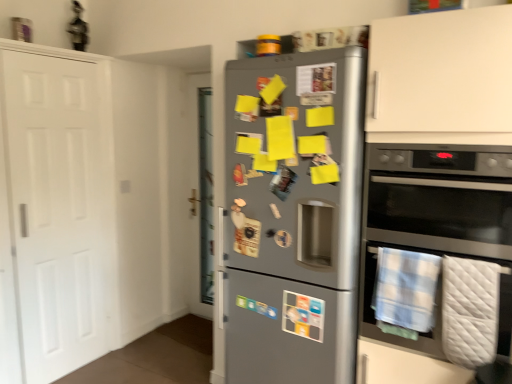
What do you see at coordinates (444, 243) in the screenshot? I see `stainless steel oven at right` at bounding box center [444, 243].

Locate an element on the screen. The width and height of the screenshot is (512, 384). white matte door at left is located at coordinates (58, 209).

Consider the image. Measure the distance between point [379,291] and camera.

Point [379,291] and camera are 6.04 feet apart.

The width and height of the screenshot is (512, 384). I want to click on white quilted blanket at lower right, which is the second blanket from left to right, so click(470, 311).

Locate an element on the screen. The image size is (512, 384). satin silver fridge at center is located at coordinates (293, 216).

From the image's perspective, relative to blue plaid towel at lower right, which is counted as the second blanket, starting from the right, is white matte door at left above or below?

Based on their image positions, white matte door at left is located above blue plaid towel at lower right, which is counted as the second blanket, starting from the right.

Do you think white matte door at left is within blue plaid towel at lower right, which is counted as the second blanket, starting from the right, or outside of it?

white matte door at left lies outside blue plaid towel at lower right, which is counted as the second blanket, starting from the right.

This screenshot has height=384, width=512. Identify the location of door behind the blue plaid towel at lower right, which is counted as the first blanket, starting from the left. (58, 209).

Would you say blue plaid towel at lower right, which is counted as the first blanket, starting from the left, is a long distance from white quilted blanket at lower right, which is the second blanket from left to right?

They are positioned close to each other.

From a real-world perspective, relative to white quilted blanket at lower right, which ranks as the first blanket in right-to-left order, is blue plaid towel at lower right, which is counted as the first blanket, starting from the left, vertically above or below?

blue plaid towel at lower right, which is counted as the first blanket, starting from the left, is situated higher than white quilted blanket at lower right, which ranks as the first blanket in right-to-left order, in the real world.

Considering the sizes of objects blue plaid towel at lower right, which is counted as the second blanket, starting from the right, and white quilted blanket at lower right, which ranks as the first blanket in right-to-left order, in the image provided, who is shorter, blue plaid towel at lower right, which is counted as the second blanket, starting from the right, or white quilted blanket at lower right, which ranks as the first blanket in right-to-left order,?

Standing shorter between the two is blue plaid towel at lower right, which is counted as the second blanket, starting from the right.

Image resolution: width=512 pixels, height=384 pixels. In order to click on blanket above the white quilted blanket at lower right, which is the second blanket from left to right (from the image's perspective) in this screenshot , I will do click(x=405, y=291).

From a real-world perspective, which object stands above the other?

From a 3D spatial view, stainless steel oven at right is above.

From the image's perspective, is satin silver fridge at center beneath stainless steel oven at right?

Correct, satin silver fridge at center appears lower than stainless steel oven at right in the image.

How different are the orientations of satin silver fridge at center and stainless steel oven at right in degrees?

They differ by 0.501 degrees in their facing directions.

Who is smaller, satin silver fridge at center or stainless steel oven at right?

stainless steel oven at right is smaller.

Is satin silver fridge at center taller than blue plaid towel at lower right, which is counted as the second blanket, starting from the right?

Yes.

In the scene shown: Is satin silver fridge at center positioned with its back to blue plaid towel at lower right, which is counted as the second blanket, starting from the right?

No, satin silver fridge at center is not facing the opposite direction of blue plaid towel at lower right, which is counted as the second blanket, starting from the right.

From a real-world perspective, who is located lower, satin silver fridge at center or blue plaid towel at lower right, which is counted as the first blanket, starting from the left?

In real-world perspective, blue plaid towel at lower right, which is counted as the first blanket, starting from the left, is lower.

From the image's perspective, is satin silver fridge at center on blue plaid towel at lower right, which is counted as the second blanket, starting from the right?

Yes.

From the image's perspective, is white matte door at left below satin silver fridge at center?

No, from the image's perspective, white matte door at left is not below satin silver fridge at center.

Is point (106, 207) more distant than point (327, 67)?

Yes, it is.

What's the angular difference between white matte door at left and satin silver fridge at center's facing directions?

92.1 degrees.

From the picture: In terms of height, does white matte door at left look taller or shorter compared to satin silver fridge at center?

Considering their sizes, white matte door at left has more height than satin silver fridge at center.

Is point (472, 261) closer or farther from the camera than point (429, 296)?

Clearly, point (472, 261) is closer to the camera than point (429, 296).

From the image's perspective, is white quilted blanket at lower right, which is the second blanket from left to right, located above or below stainless steel oven at right?

white quilted blanket at lower right, which is the second blanket from left to right, is below stainless steel oven at right.

In the image, is white quilted blanket at lower right, which ranks as the first blanket in right-to-left order, positioned in front of or behind stainless steel oven at right?

Clearly, white quilted blanket at lower right, which ranks as the first blanket in right-to-left order, is behind stainless steel oven at right.

Is white quilted blanket at lower right, which ranks as the first blanket in right-to-left order, with stainless steel oven at right?

white quilted blanket at lower right, which ranks as the first blanket in right-to-left order, and stainless steel oven at right are clearly separated.

From the image's perspective, is satin silver fridge at center on top of white quilted blanket at lower right, which ranks as the first blanket in right-to-left order?

Yes, from the image's perspective, satin silver fridge at center is above white quilted blanket at lower right, which ranks as the first blanket in right-to-left order.

Is satin silver fridge at center inside or outside of white quilted blanket at lower right, which is the second blanket from left to right?

The correct answer is: outside.

Can you tell me how much satin silver fridge at center and white quilted blanket at lower right, which is the second blanket from left to right, differ in facing direction?

1.23 degrees.

Identify the location of the 2nd blanket to the right of the satin silver fridge at center, starting your count from the anchor. This screenshot has width=512, height=384. (470, 311).

Locate an element on the screen. The image size is (512, 384). door to the left of blue plaid towel at lower right, which is counted as the first blanket, starting from the left is located at coordinates (x=58, y=209).

This screenshot has width=512, height=384. I want to click on blanket above the white quilted blanket at lower right, which ranks as the first blanket in right-to-left order (from a real-world perspective), so click(405, 291).

From the image, which object appears to be farther from white matte door at left, satin silver fridge at center or blue plaid towel at lower right, which is counted as the first blanket, starting from the left?

The object further to white matte door at left is blue plaid towel at lower right, which is counted as the first blanket, starting from the left.

In the scene shown: Looking at the image, which one is located further to white matte door at left, white quilted blanket at lower right, which ranks as the first blanket in right-to-left order, or satin silver fridge at center?

Based on the image, white quilted blanket at lower right, which ranks as the first blanket in right-to-left order, appears to be further to white matte door at left.

Looking at the image, which one is located further to satin silver fridge at center, stainless steel oven at right or white matte door at left?

Based on the image, white matte door at left appears to be further to satin silver fridge at center.

Looking at the image, which one is located further to white matte door at left, stainless steel oven at right or satin silver fridge at center?

stainless steel oven at right lies further to white matte door at left than the other object.

Looking at the image, which one is located closer to white matte door at left, blue plaid towel at lower right, which is counted as the second blanket, starting from the right, or satin silver fridge at center?

Based on the image, satin silver fridge at center appears to be nearer to white matte door at left.

Estimate the real-world distances between objects in this image. Which object is further from stainless steel oven at right, white matte door at left or blue plaid towel at lower right, which is counted as the first blanket, starting from the left?

white matte door at left.

Based on their spatial positions, is white matte door at left or stainless steel oven at right closer to satin silver fridge at center?

stainless steel oven at right.

When comparing their distances from blue plaid towel at lower right, which is counted as the first blanket, starting from the left, does satin silver fridge at center or stainless steel oven at right seem closer?

stainless steel oven at right is positioned closer to the anchor blue plaid towel at lower right, which is counted as the first blanket, starting from the left.

Where is `refrigerator between white matte door at left and blue plaid towel at lower right, which is counted as the first blanket, starting from the left, in the horizontal direction`? refrigerator between white matte door at left and blue plaid towel at lower right, which is counted as the first blanket, starting from the left, in the horizontal direction is located at coordinates (293, 216).

This screenshot has height=384, width=512. Find the location of `blanket between satin silver fridge at center and white quilted blanket at lower right, which is the second blanket from left to right, in the horizontal direction`. blanket between satin silver fridge at center and white quilted blanket at lower right, which is the second blanket from left to right, in the horizontal direction is located at coordinates (405, 291).

At what (x,y) coordinates should I click in order to perform the action: click on refrigerator between white matte door at left and white quilted blanket at lower right, which is the second blanket from left to right, in the horizontal direction. Please return your answer as a coordinate pair (x, y). The image size is (512, 384). Looking at the image, I should click on (293, 216).

Find the location of a particular element. The width and height of the screenshot is (512, 384). blanket between white matte door at left and white quilted blanket at lower right, which is the second blanket from left to right is located at coordinates (405, 291).